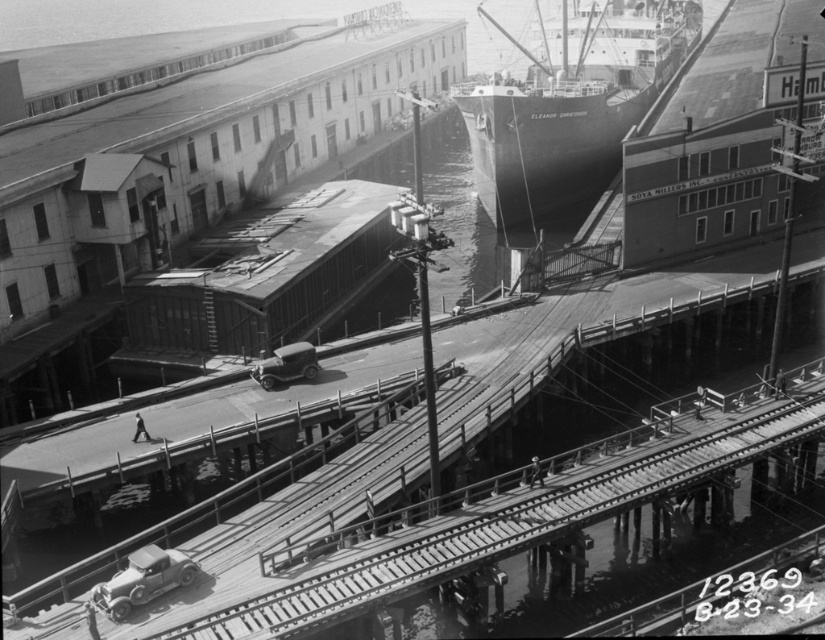
You are a photographer standing on the dock and want to capture both the dark gray matte ship at upper center and the shiny silver car at center in your photo. Which object will appear taller in the final image?

The dark gray matte ship at upper center will appear taller in the photo because it has a greater height compared to the shiny silver car at center.

From the picture: You are a delivery person needing to reach the dark gray matte ship at upper center from your current position near the smooth wooden planks at center. Given that your delivery cart can only move on the dock and has a maximum range of 40 meters, will you be able to reach the ship without leaving the dock?

The smooth wooden planks at center is 45.62 meters from the dark gray matte ship at upper center. Since the distance exceeds the cart maximum range of 40 meters, you will not be able to reach the ship without leaving the dock.

You are standing at the point labeled point [510,512] in the image. What type of surface are you standing on?

You are standing on smooth wooden planks at center.